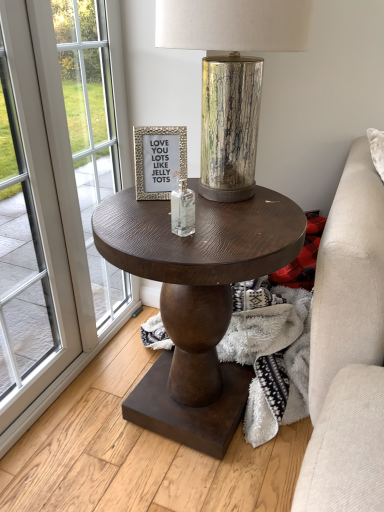
Where is `empty space that is to the right of silver textured frame at center`? This screenshot has width=384, height=512. empty space that is to the right of silver textured frame at center is located at coordinates (231, 203).